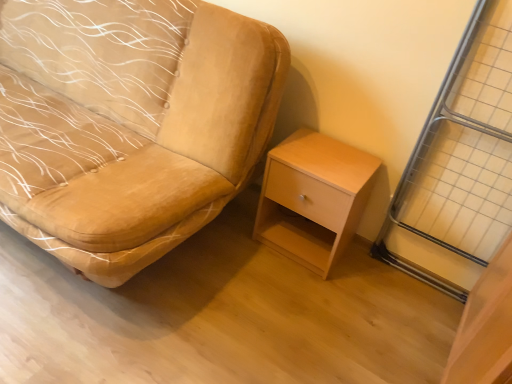
Locate an element on the screen. This screenshot has height=384, width=512. empty space that is ontop of light wood/finely finished nightstand at lower right (from a real-world perspective) is located at coordinates (325, 156).